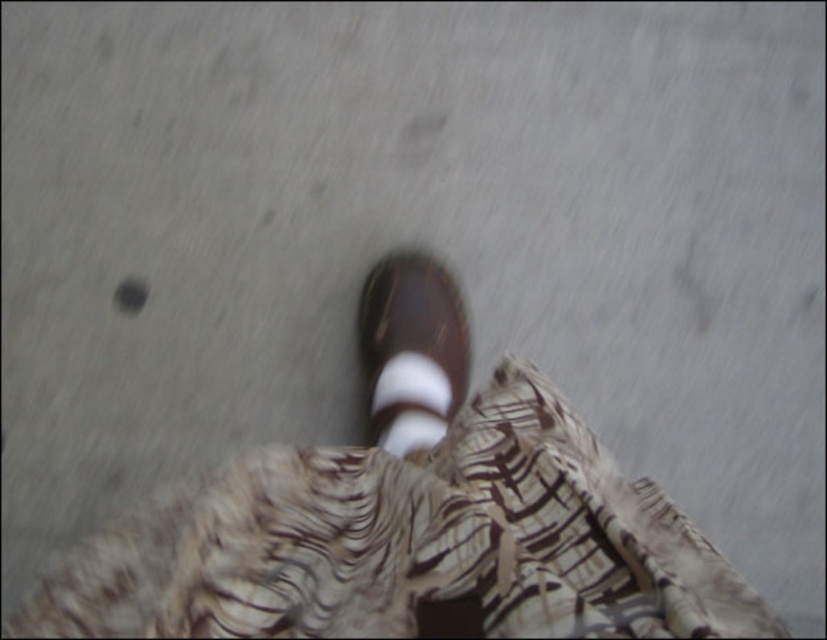
Is brown leather shoe at center taller than white striped sock at center?

Correct, brown leather shoe at center is much taller as white striped sock at center.

Is brown leather shoe at center shorter than white striped sock at center?

Incorrect, brown leather shoe at center's height does not fall short of white striped sock at center's.

The width and height of the screenshot is (827, 640). I want to click on brown leather shoe at center, so click(x=410, y=348).

Where is `brown leather shoe at center`? brown leather shoe at center is located at coordinates (410, 348).